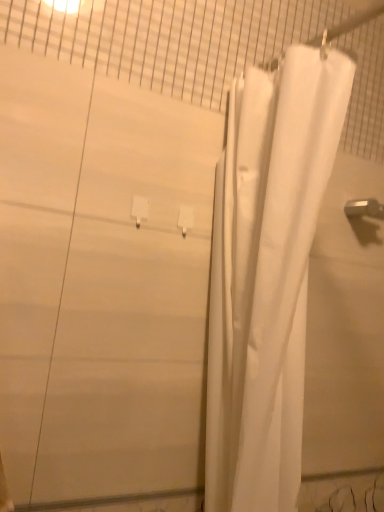
This screenshot has height=512, width=384. Find the location of `metallic silver faucet at upper right`. metallic silver faucet at upper right is located at coordinates (364, 208).

Describe the element at coordinates (364, 208) in the screenshot. I see `metallic silver faucet at upper right` at that location.

Measure the distance between point (376, 214) and camera.

Point (376, 214) and camera are 1.21 meters apart from each other.

The width and height of the screenshot is (384, 512). I want to click on metallic silver faucet at upper right, so [364, 208].